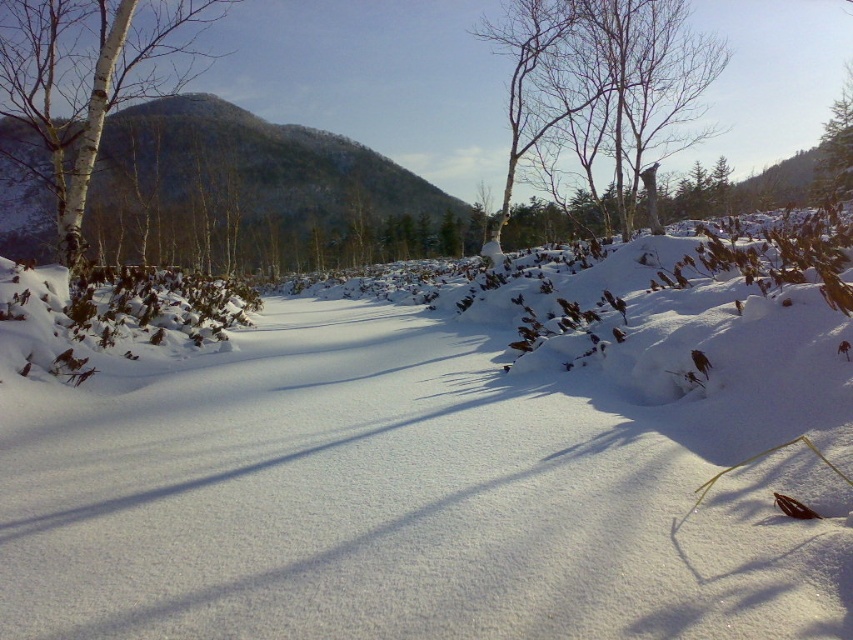
You are standing in the winter landscape and want to take a photo of the white fluffy snow at center and the bare branches at upper center. Which object should you focus on first if you want to capture both in your shot?

You should focus on the white fluffy snow at center first because it is positioned on the left side of the bare branches at upper center, so adjusting focus to include both might require starting with the closer object.

You are an observer standing in the winter landscape. You notice the white fluffy snow at center and the white bark tree at left. Which of these two objects is thicker in the scene?

The white fluffy snow at center is thinner than the white bark tree at left, so the white bark tree at left is thicker.